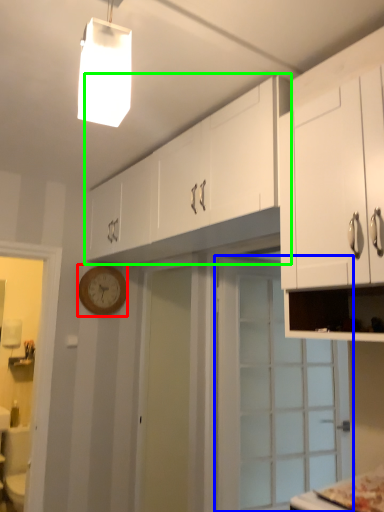
Question: Which object is positioned closest to clock (highlighted by a red box)? Select from door (highlighted by a blue box) and cabinetry (highlighted by a green box).

Choices:
 (A) door
 (B) cabinetry

Answer: (B)